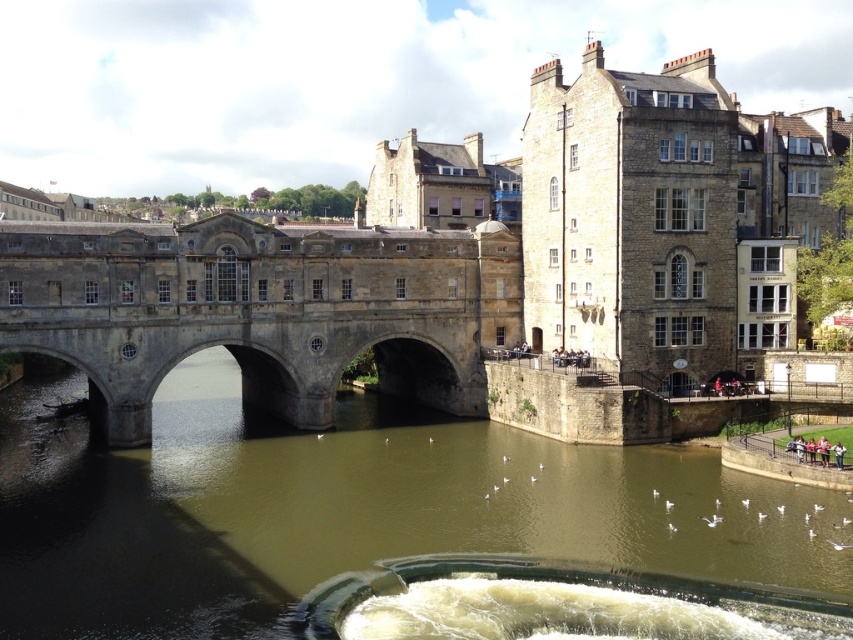
Question: Which point is closer to the camera?

Choices:
 (A) stone bridge at center
 (B) brown stone river at center

Answer: (B)

Question: Which object is closer to the camera taking this photo?

Choices:
 (A) stone bridge at center
 (B) brown stone river at center

Answer: (B)

Question: Does brown stone river at center appear on the left side of stone bridge at center?

Choices:
 (A) no
 (B) yes

Answer: (B)

Question: Is brown stone river at center thinner than stone bridge at center?

Choices:
 (A) yes
 (B) no

Answer: (B)

Question: Does brown stone river at center appear under stone bridge at center?

Choices:
 (A) no
 (B) yes

Answer: (B)